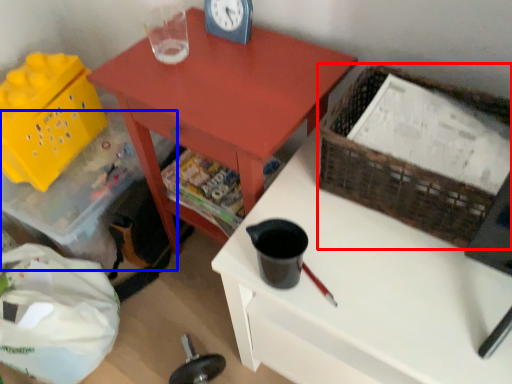
Question: Which of the following is the closest to the observer, basket (highlighted by a red box) or storage box (highlighted by a blue box)?

Choices:
 (A) basket
 (B) storage box

Answer: (A)